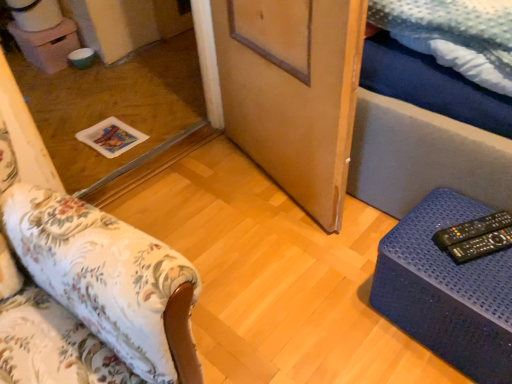
Question: Is floral fabric ottoman at lower left, the 2th furniture in the right-to-left sequence, a part of black plastic remote at lower right, which is counted as the 1th remote, starting from the back?

Choices:
 (A) no
 (B) yes

Answer: (A)

Question: From a real-world perspective, is black plastic remote at lower right, which is counted as the 1th remote, starting from the back, on top of floral fabric ottoman at lower left, the 2th furniture in the right-to-left sequence?

Choices:
 (A) yes
 (B) no

Answer: (B)

Question: Does black plastic remote at lower right, the second remote in the front-to-back sequence, have a larger size compared to floral fabric ottoman at lower left, the 2th furniture in the right-to-left sequence?

Choices:
 (A) no
 (B) yes

Answer: (A)

Question: Can you confirm if black plastic remote at lower right, the second remote in the front-to-back sequence, is shorter than floral fabric ottoman at lower left, which is counted as the first furniture, starting from the left?

Choices:
 (A) no
 (B) yes

Answer: (B)

Question: Can you confirm if black plastic remote at lower right, the second remote in the front-to-back sequence, is taller than floral fabric ottoman at lower left, which is counted as the first furniture, starting from the left?

Choices:
 (A) yes
 (B) no

Answer: (B)

Question: From a real-world perspective, is black plastic remote at lower right, which is counted as the 1th remote, starting from the back, beneath floral fabric ottoman at lower left, the 2th furniture in the right-to-left sequence?

Choices:
 (A) yes
 (B) no

Answer: (A)

Question: Is wooden door at center at the back of black plastic remote at lower right, the 2th remote viewed from the back?

Choices:
 (A) yes
 (B) no

Answer: (B)

Question: Can you confirm if black plastic remote at lower right, which is the 1th remote in front-to-back order, is taller than wooden door at center?

Choices:
 (A) yes
 (B) no

Answer: (B)

Question: Can you confirm if black plastic remote at lower right, the 2th remote viewed from the back, is shorter than wooden door at center?

Choices:
 (A) no
 (B) yes

Answer: (B)

Question: Does black plastic remote at lower right, which is the 1th remote in front-to-back order, have a lesser width compared to wooden door at center?

Choices:
 (A) no
 (B) yes

Answer: (A)

Question: From the image's perspective, would you say black plastic remote at lower right, which is the 1th remote in front-to-back order, is shown under wooden door at center?

Choices:
 (A) yes
 (B) no

Answer: (A)

Question: From the image's perspective, is black plastic remote at lower right, which is the 1th remote in front-to-back order, on wooden door at center?

Choices:
 (A) yes
 (B) no

Answer: (B)

Question: Considering the relative positions of floral fabric ottoman at lower left, the 2th furniture in the right-to-left sequence, and wooden door at center in the image provided, is floral fabric ottoman at lower left, the 2th furniture in the right-to-left sequence, to the left of wooden door at center from the viewer's perspective?

Choices:
 (A) yes
 (B) no

Answer: (A)